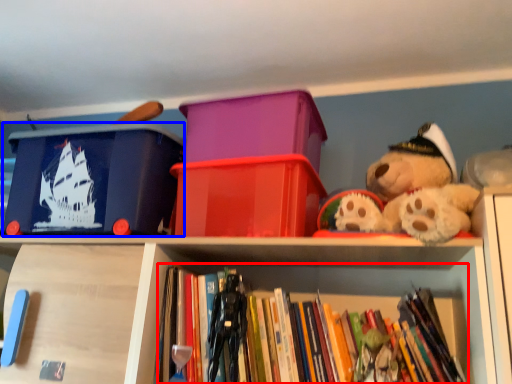
Question: Which object appears farthest to the camera in this image, book (highlighted by a red box) or storage box (highlighted by a blue box)?

Choices:
 (A) book
 (B) storage box

Answer: (B)